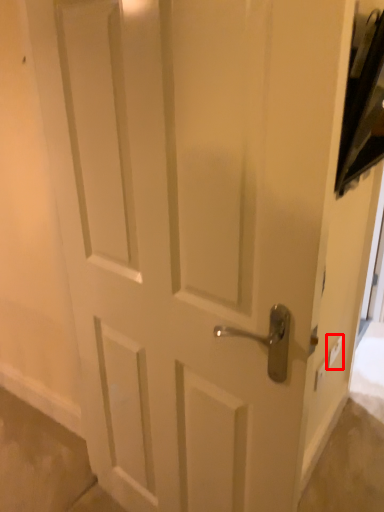
Question: From the image's perspective, where is light switch (annotated by the red box) located relative to light switch?

Choices:
 (A) below
 (B) above

Answer: (B)